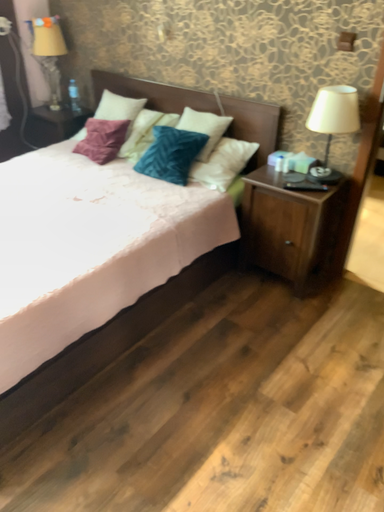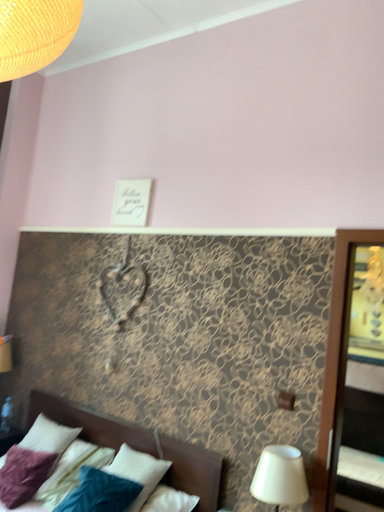
Question: How did the camera likely rotate when shooting the video?

Choices:
 (A) rotated upward
 (B) rotated downward

Answer: (A)